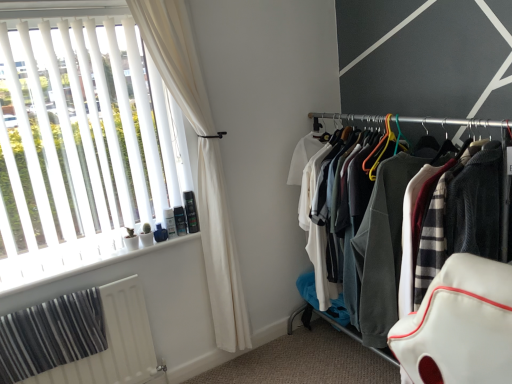
Find the location of `white plastic window sill at lower left`. white plastic window sill at lower left is located at coordinates (70, 261).

This screenshot has height=384, width=512. I want to click on white blinds at left, so click(x=79, y=146).

What is the approximate height of white fabric curtain at left?

white fabric curtain at left is 1.69 meters tall.

Looking at this image, in order to face white textured radiator at lower left, should I rotate leftwards or rightwards?

Rotate left and turn 21.311 degrees.

This screenshot has height=384, width=512. I want to click on white textured radiator at lower left, so click(x=81, y=338).

At what (x,y) coordinates should I click in order to perform the action: click on white plastic window sill at lower left. Please return your answer as a coordinate pair (x, y). The height and width of the screenshot is (384, 512). Looking at the image, I should click on click(70, 261).

Does textured fabric clothes at right touch white plastic window sill at lower left?

No, textured fabric clothes at right is not touching white plastic window sill at lower left.

Is white plastic window sill at lower left at the back of textured fabric clothes at right?

No.

Considering the sizes of objects textured fabric clothes at right and white plastic window sill at lower left in the image provided, who is taller, textured fabric clothes at right or white plastic window sill at lower left?

textured fabric clothes at right.

Which of these two, textured fabric clothes at right or white plastic window sill at lower left, is smaller?

Smaller between the two is white plastic window sill at lower left.

Can you confirm if white plastic window sill at lower left is taller than textured fabric clothes at right?

No.

Between white plastic window sill at lower left and textured fabric clothes at right, which one is positioned behind?

white plastic window sill at lower left is more distant.

Choose the correct answer: Is white plastic window sill at lower left inside textured fabric clothes at right or outside it?

white plastic window sill at lower left is located beyond the bounds of textured fabric clothes at right.

Is white fabric curtain at left in front of or behind white textured radiator at lower left in the image?

Clearly, white fabric curtain at left is in front of white textured radiator at lower left.

How many degrees apart are the facing directions of white fabric curtain at left and white textured radiator at lower left?

white fabric curtain at left and white textured radiator at lower left are facing 0.121 degrees away from each other.

Is white fabric curtain at left not near white textured radiator at lower left?

No, there isn't a large distance between white fabric curtain at left and white textured radiator at lower left.

Is white fabric curtain at left not within white textured radiator at lower left?

Yes.

Is white textured radiator at lower left shorter than white blinds at left?

Correct, white textured radiator at lower left is not as tall as white blinds at left.

Would you say white textured radiator at lower left is a long distance from white blinds at left?

No, white textured radiator at lower left is in close proximity to white blinds at left.

From the image's perspective, which object appears higher, white textured radiator at lower left or white blinds at left?

white blinds at left is shown above in the image.

From a real-world perspective, which is physically below, white textured radiator at lower left or white blinds at left?

white textured radiator at lower left, from a real-world perspective.

Does white fabric curtain at left have a greater height compared to textured fabric clothes at right?

Indeed, white fabric curtain at left has a greater height compared to textured fabric clothes at right.

Which point is more distant from viewer, (228, 311) or (436, 173)?

Point (228, 311)

Between white fabric curtain at left and textured fabric clothes at right, which one has larger size?

With larger size is textured fabric clothes at right.

From the image's perspective, which is above, white fabric curtain at left or textured fabric clothes at right?

white fabric curtain at left, from the image's perspective.

Is white plastic window sill at lower left wider than white fabric curtain at left?

Yes, white plastic window sill at lower left is wider than white fabric curtain at left.

The image size is (512, 384). Find the location of `curtain that appears on the right of white plastic window sill at lower left`. curtain that appears on the right of white plastic window sill at lower left is located at coordinates (199, 162).

Which is in front, white plastic window sill at lower left or white fabric curtain at left?

white fabric curtain at left.

From the image's perspective, does white plastic window sill at lower left appear higher than white fabric curtain at left?

Incorrect, from the image's perspective, white plastic window sill at lower left is lower than white fabric curtain at left.

From the image's perspective, between white fabric curtain at left and white plastic window sill at lower left, which one is located above?

white fabric curtain at left.

From a real-world perspective, is white fabric curtain at left above or below white plastic window sill at lower left?

From a real-world perspective, white fabric curtain at left is physically above white plastic window sill at lower left.

Considering the relative sizes of white fabric curtain at left and white plastic window sill at lower left in the image provided, is white fabric curtain at left taller than white plastic window sill at lower left?

Yes, white fabric curtain at left is taller than white plastic window sill at lower left.

Which is in front, white fabric curtain at left or white plastic window sill at lower left?

white fabric curtain at left is closer to the camera.

Find the location of a particular element. closet below the white plastic window sill at lower left (from a real-world perspective) is located at coordinates (453, 316).

This screenshot has height=384, width=512. I want to click on window sill to the left of textured fabric clothes at right, so pos(70,261).

Looking at the image, which one is located further to white textured radiator at lower left, white blinds at left or white fabric curtain at left?

white fabric curtain at left is further to white textured radiator at lower left.

Based on their spatial positions, is white textured radiator at lower left or white blinds at left further from white fabric curtain at left?

The object further to white fabric curtain at left is white textured radiator at lower left.

Based on their spatial positions, is textured fabric clothes at right or white plastic window sill at lower left further from white blinds at left?

textured fabric clothes at right.

When comparing their distances from white blinds at left, does white fabric curtain at left or white plastic window sill at lower left seem closer?

white plastic window sill at lower left.

When comparing their distances from textured fabric clothes at right, does white blinds at left or white fabric curtain at left seem further?

white blinds at left is positioned further to the anchor textured fabric clothes at right.

Considering their positions, is white textured radiator at lower left positioned closer to white blinds at left than white plastic window sill at lower left?

Based on the image, white plastic window sill at lower left appears to be nearer to white blinds at left.

When comparing their distances from white textured radiator at lower left, does white blinds at left or textured fabric clothes at right seem closer?

white blinds at left is positioned closer to the anchor white textured radiator at lower left.

Looking at the image, which one is located closer to white textured radiator at lower left, white plastic window sill at lower left or white blinds at left?

white plastic window sill at lower left.

Where is `window sill located between white blinds at left and textured fabric clothes at right in the left-right direction`? The height and width of the screenshot is (384, 512). window sill located between white blinds at left and textured fabric clothes at right in the left-right direction is located at coordinates (70, 261).

What are the coordinates of `radiator located between white blinds at left and textured fabric clothes at right in the left-right direction` in the screenshot? It's located at (81, 338).

I want to click on curtain between white plastic window sill at lower left and textured fabric clothes at right from left to right, so click(x=199, y=162).

The image size is (512, 384). What are the coordinates of `window sill between white blinds at left and white fabric curtain at left from left to right` in the screenshot? It's located at (70, 261).